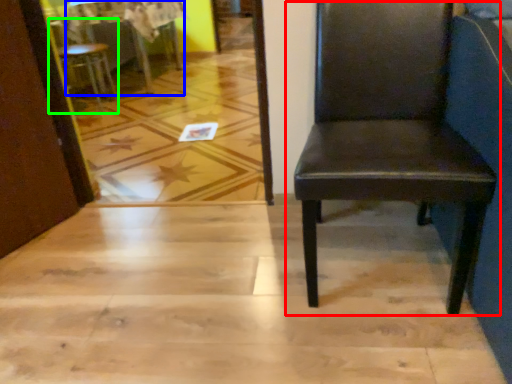
Question: Which object is the closest to the chair (highlighted by a red box)? Choose among these: table (highlighted by a blue box) or chair (highlighted by a green box).

Choices:
 (A) table
 (B) chair

Answer: (B)